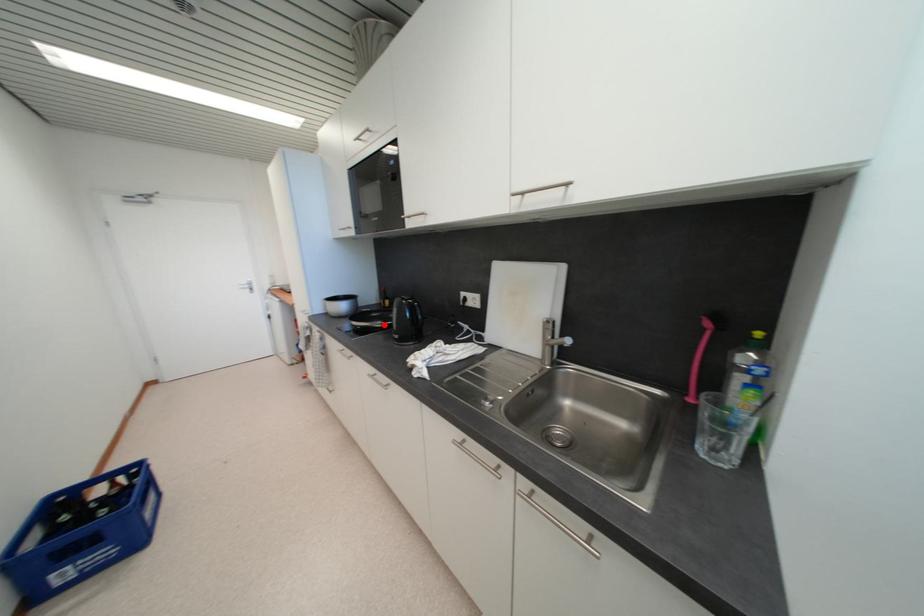
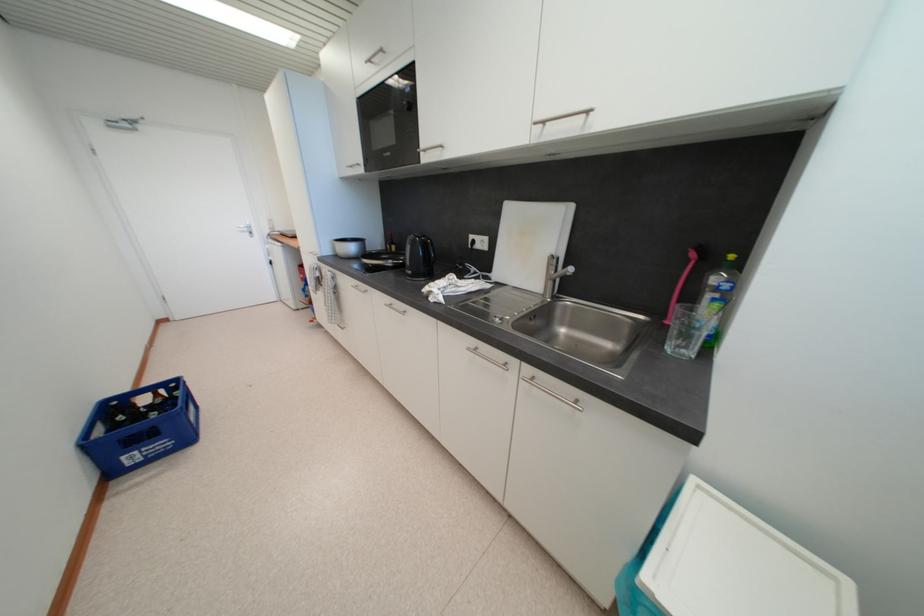
The point at the highlighted location is marked in the first image. Where is the corresponding point in the second image?

(395, 264)